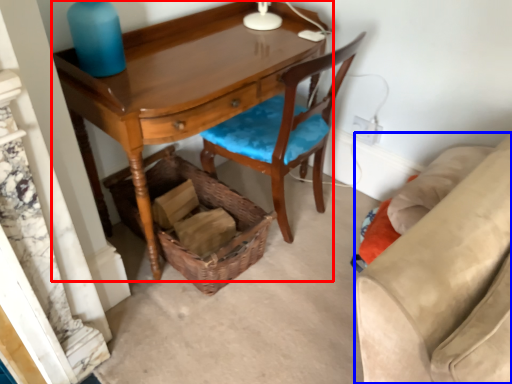
Question: Which of the following is the farthest to the observer, desk (highlighted by a red box) or studio couch (highlighted by a blue box)?

Choices:
 (A) desk
 (B) studio couch

Answer: (B)